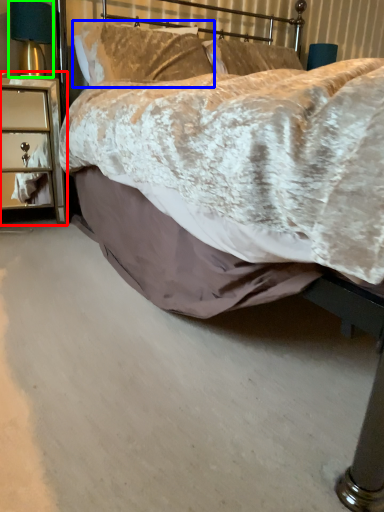
Question: Which object is the closest to the nightstand (highlighted by a red box)? Choose among these: pillow (highlighted by a blue box) or bedside lamp (highlighted by a green box).

Choices:
 (A) pillow
 (B) bedside lamp

Answer: (B)